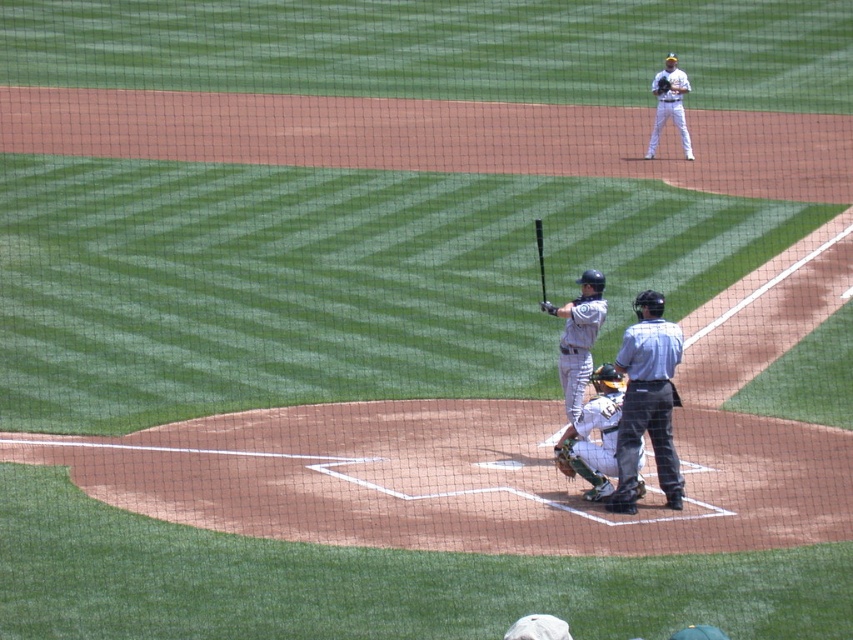
You are a spectator at the baseball game and want to take a photo of the matte black bat at center and the dark brown leather glove at upper right. Which object should you focus on first if you want to capture both in the same frame without moving the camera?

The matte black bat at center is below the dark brown leather glove at upper right, so you should focus on the dark brown leather glove at upper right first to ensure both are in the frame.

You are a player in the outfield and want to position yourself closer to the gray uniform bat at center. Based on the coordinates provided, where should you move relative to the image?

The gray uniform bat at center is located at coordinates point (579, 339). To position yourself closer, move towards the center of the image where the bat is situated.